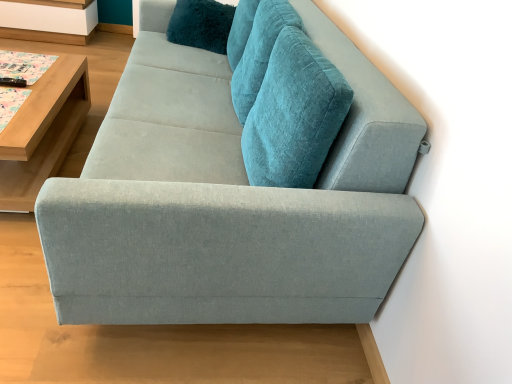
Where is `white wood shelf at upper left`? white wood shelf at upper left is located at coordinates (48, 20).

This screenshot has width=512, height=384. What do you see at coordinates (42, 131) in the screenshot?
I see `light wood/wooden table at left` at bounding box center [42, 131].

The height and width of the screenshot is (384, 512). What are the coordinates of `teal plush pillow at upper center` in the screenshot? It's located at (201, 24).

Based on the photo, is light gray fabric couch at center shorter than white wood shelf at upper left?

No, light gray fabric couch at center is not shorter than white wood shelf at upper left.

Is light gray fabric couch at center positioned beyond the bounds of white wood shelf at upper left?

light gray fabric couch at center is positioned outside white wood shelf at upper left.

From a real-world perspective, relative to white wood shelf at upper left, is light gray fabric couch at center vertically above or below?

light gray fabric couch at center is situated higher than white wood shelf at upper left in the real world.

Would you consider light gray fabric couch at center to be distant from white wood shelf at upper left?

Absolutely, light gray fabric couch at center is distant from white wood shelf at upper left.

You are a GUI agent. You are given a task and a screenshot of the screen. Output one action in this format:
    pyautogui.click(x=<x>, y=<y>)
    Task: Click on the shelf beneath the teal plush pillow at upper center (from a real-world perspective)
    This screenshot has height=384, width=512.
    Given the screenshot: What is the action you would take?
    pyautogui.click(x=48, y=20)

Can you tell me how much teal plush pillow at upper center and white wood shelf at upper left differ in facing direction?

teal plush pillow at upper center and white wood shelf at upper left are facing 3.81 degrees away from each other.

Considering the sizes of objects teal plush pillow at upper center and white wood shelf at upper left in the image provided, who is bigger, teal plush pillow at upper center or white wood shelf at upper left?

Bigger between the two is white wood shelf at upper left.

From their relative heights in the image, would you say teal plush pillow at upper center is taller or shorter than white wood shelf at upper left?

In the image, teal plush pillow at upper center appears to be taller than white wood shelf at upper left.

Is point (22, 151) closer or farther from the camera than point (89, 22)?

Point (22, 151) appears to be closer to the viewer than point (89, 22).

Is light wood/wooden table at left situated inside white wood shelf at upper left or outside?

light wood/wooden table at left is not inside white wood shelf at upper left, it's outside.

Considering the relative positions of light wood/wooden table at left and white wood shelf at upper left in the image provided, is light wood/wooden table at left to the left or to the right of white wood shelf at upper left?

light wood/wooden table at left is positioned on white wood shelf at upper left's right side.

Looking at this image, can you tell me how much light wood/wooden table at left and white wood shelf at upper left differ in facing direction?

The angular difference between light wood/wooden table at left and white wood shelf at upper left is 90.5 degrees.

Based on the photo, considering their positions, is white wood shelf at upper left located in front of or behind light wood/wooden table at left?

white wood shelf at upper left is behind light wood/wooden table at left.

Where is `shelf located behind the light wood/wooden table at left`? The width and height of the screenshot is (512, 384). shelf located behind the light wood/wooden table at left is located at coordinates (48, 20).

From the image's perspective, which one is positioned higher, white wood shelf at upper left or light wood/wooden table at left?

From the image's view, white wood shelf at upper left is above.

Is white wood shelf at upper left bigger than light wood/wooden table at left?

Actually, white wood shelf at upper left might be smaller than light wood/wooden table at left.

Looking at their sizes, would you say white wood shelf at upper left is wider or thinner than teal plush pillow at upper center?

white wood shelf at upper left is wider than teal plush pillow at upper center.

Which is behind, point (70, 22) or point (205, 6)?

The point (70, 22) is more distant.

Is white wood shelf at upper left taller or shorter than teal plush pillow at upper center?

Considering their sizes, white wood shelf at upper left has less height than teal plush pillow at upper center.

From the image's perspective, is light wood/wooden table at left beneath light gray fabric couch at center?

Yes, from the image's perspective, light wood/wooden table at left is below light gray fabric couch at center.

Considering the positions of objects light wood/wooden table at left and light gray fabric couch at center in the image provided, who is in front, light wood/wooden table at left or light gray fabric couch at center?

light gray fabric couch at center is more forward.

Which object is positioned more to the right, light wood/wooden table at left or light gray fabric couch at center?

light gray fabric couch at center.

Considering the sizes of teal plush pillow at upper center and light wood/wooden table at left in the image, is teal plush pillow at upper center taller or shorter than light wood/wooden table at left?

A: In the image, teal plush pillow at upper center appears to be taller than light wood/wooden table at left.

From a real-world perspective, between teal plush pillow at upper center and light wood/wooden table at left, who is vertically lower?

light wood/wooden table at left.

Is teal plush pillow at upper center completely or partially outside of light wood/wooden table at left?

Indeed, teal plush pillow at upper center is completely outside light wood/wooden table at left.

From the picture: Can you confirm if teal plush pillow at upper center is positioned to the right of light wood/wooden table at left?

Correct, you'll find teal plush pillow at upper center to the right of light wood/wooden table at left.

Identify the location of shelf above the light gray fabric couch at center (from the image's perspective). The height and width of the screenshot is (384, 512). (48, 20).

Image resolution: width=512 pixels, height=384 pixels. What are the coordinates of `shelf behind the teal plush pillow at upper center` in the screenshot? It's located at (48, 20).

Which object lies further to the anchor point white wood shelf at upper left, teal plush pillow at upper center or light gray fabric couch at center?

light gray fabric couch at center.

Looking at the image, which one is located closer to light gray fabric couch at center, light wood/wooden table at left or white wood shelf at upper left?

The object closer to light gray fabric couch at center is light wood/wooden table at left.

From the image, which object appears to be nearer to light wood/wooden table at left, white wood shelf at upper left or light gray fabric couch at center?

light gray fabric couch at center is positioned closer to the anchor light wood/wooden table at left.

From the picture: From the image, which object appears to be farther from white wood shelf at upper left, light wood/wooden table at left or light gray fabric couch at center?

light gray fabric couch at center is positioned further to the anchor white wood shelf at upper left.

From the image, which object appears to be farther from white wood shelf at upper left, light wood/wooden table at left or teal plush pillow at upper center?

The object further to white wood shelf at upper left is light wood/wooden table at left.

Considering their positions, is light wood/wooden table at left positioned closer to light gray fabric couch at center than teal plush pillow at upper center?

light wood/wooden table at left is closer to light gray fabric couch at center.

Based on the photo, considering their positions, is white wood shelf at upper left positioned further to light gray fabric couch at center than light wood/wooden table at left?

white wood shelf at upper left.

Considering their positions, is teal plush pillow at upper center positioned closer to light gray fabric couch at center than white wood shelf at upper left?

teal plush pillow at upper center is closer to light gray fabric couch at center.

You are a GUI agent. You are given a task and a screenshot of the screen. Output one action in this format:
    pyautogui.click(x=<x>, y=<y>)
    Task: Click on the table positioned between light gray fabric couch at center and teal plush pillow at upper center from near to far
    
    Given the screenshot: What is the action you would take?
    pyautogui.click(x=42, y=131)

Identify the location of table between light gray fabric couch at center and white wood shelf at upper left along the z-axis. This screenshot has width=512, height=384. (42, 131).

At what (x,y) coordinates should I click in order to perform the action: click on pillow between light gray fabric couch at center and white wood shelf at upper left from front to back. Please return your answer as a coordinate pair (x, y). Image resolution: width=512 pixels, height=384 pixels. Looking at the image, I should click on (201, 24).

What are the coordinates of `pillow located between light wood/wooden table at left and white wood shelf at upper left in the depth direction` in the screenshot? It's located at (201, 24).